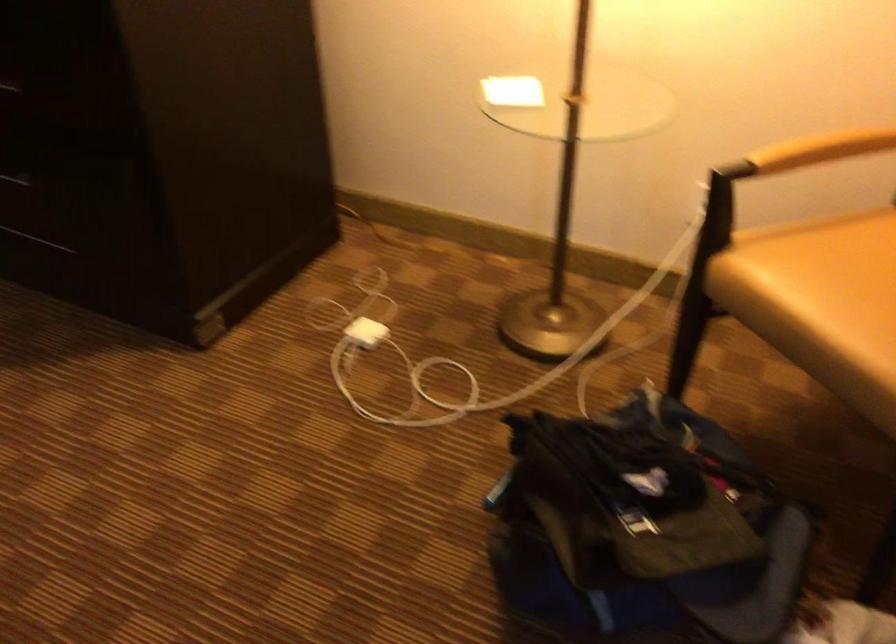
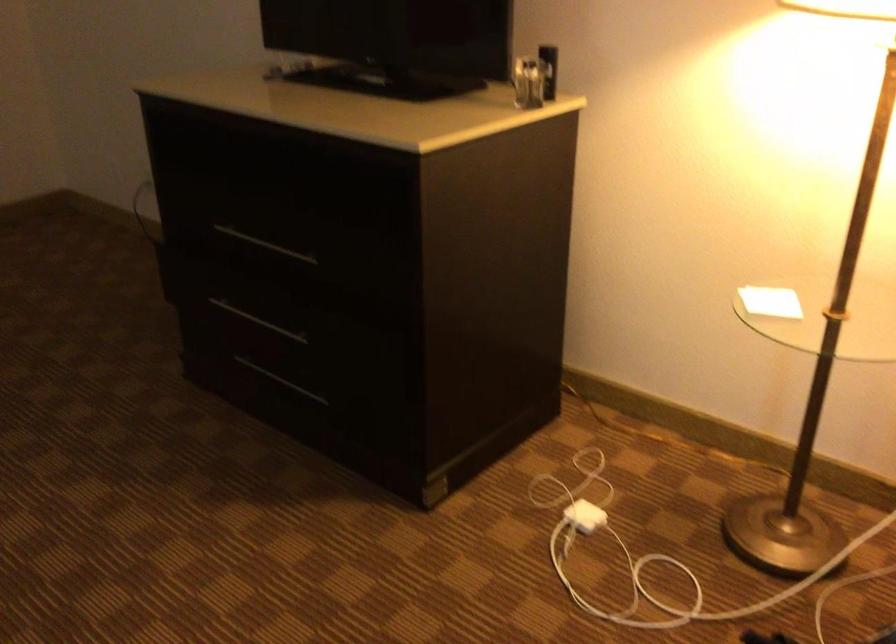
The images are taken continuously from a first-person perspective. In which direction are you moving?

The movement direction of the cameraman is left, backward.